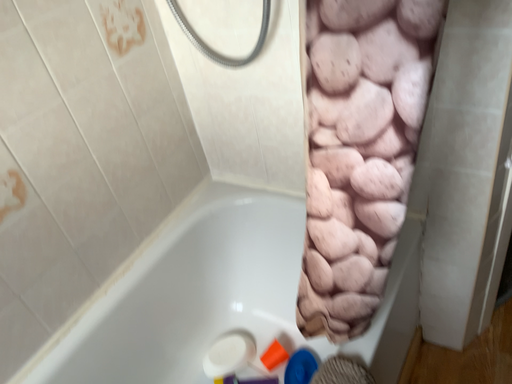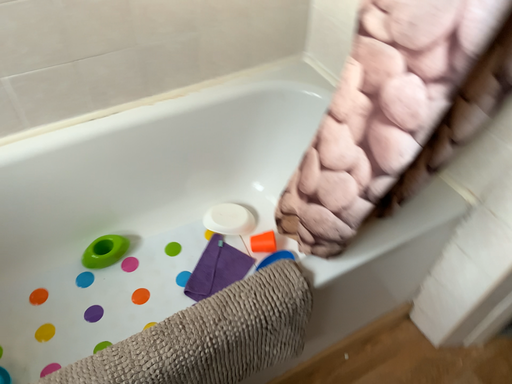
Question: Which way did the camera rotate in the video?

Choices:
 (A) rotated left
 (B) rotated right

Answer: (A)